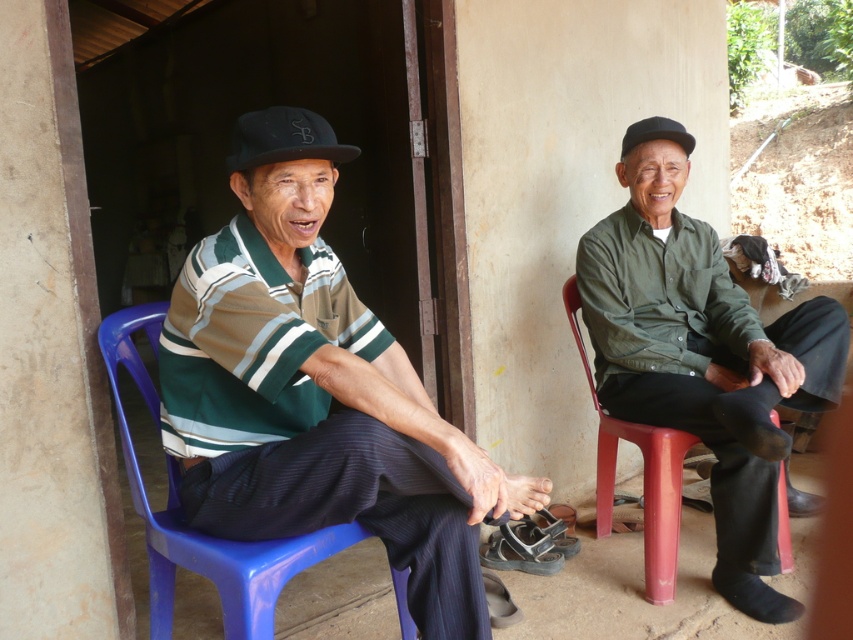
Question: Observing the image, what is the correct spatial positioning of matte striped shirt at left in reference to blue plastic chair at left?

Choices:
 (A) below
 (B) above

Answer: (B)

Question: Is blue plastic chair at left above black fabric cap at upper right?

Choices:
 (A) yes
 (B) no

Answer: (B)

Question: Which point is closer to the camera?

Choices:
 (A) black matte cap at upper center
 (B) black fabric cap at upper right
 (C) matte striped shirt at left
 (D) blue plastic chair at left

Answer: (C)

Question: Which object appears farthest from the camera in this image?

Choices:
 (A) black matte cap at upper center
 (B) black fabric cap at upper right
 (C) blue plastic chair at left

Answer: (B)

Question: From the image, what is the correct spatial relationship of matte striped shirt at left in relation to red plastic chair at right?

Choices:
 (A) left
 (B) right

Answer: (A)

Question: Which object is farther from the camera taking this photo?

Choices:
 (A) black fabric cap at upper right
 (B) blue plastic chair at left
 (C) red plastic chair at right
 (D) black matte cap at upper center

Answer: (A)